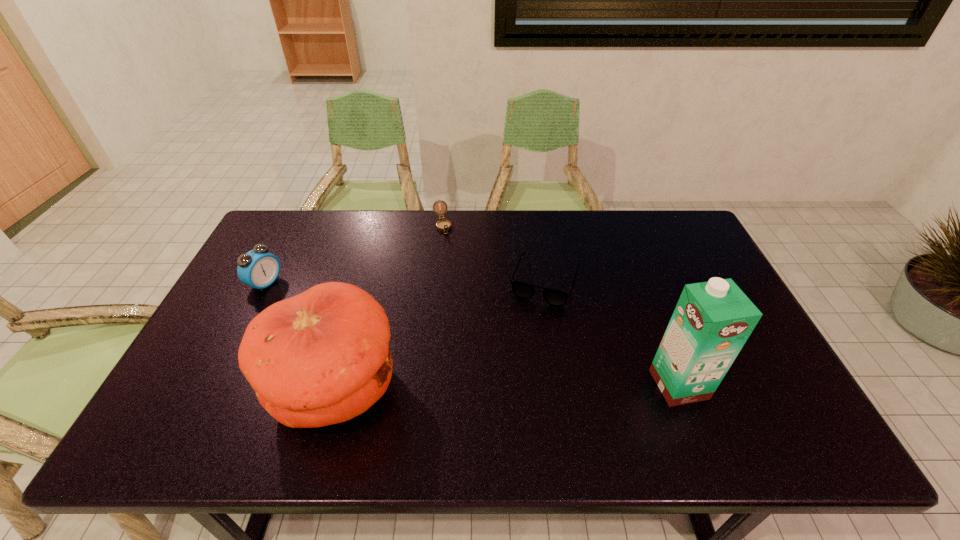
Identify the location of free space between the rightmost object and the spectacles. (612, 332).

Where is `vacant space in between the fourth object from right to left and the farthest object`? Image resolution: width=960 pixels, height=540 pixels. vacant space in between the fourth object from right to left and the farthest object is located at coordinates (389, 307).

I want to click on empty location between the fourth object from right to left and the carton, so pyautogui.click(x=507, y=387).

You are a GUI agent. You are given a task and a screenshot of the screen. Output one action in this format:
    pyautogui.click(x=<x>, y=<y>)
    Task: Click on the unoccupied position between the pumpkin and the third object from left to right
    
    Given the screenshot: What is the action you would take?
    coord(389,307)

Identify the location of free space between the second object from left to right and the rightmost object. (507, 387).

What are the coordinates of `vacant area that lies between the carton and the second object from left to right` in the screenshot? It's located at [507, 387].

Identify which object is the nearest to the third shortest object. Please provide its 2D coordinates. Your answer should be formatted as a tuple, i.e. [(x, y)], where the tuple contains the x and y coordinates of a point satisfying the conditions above.

[(322, 357)]

At what (x,y) coordinates should I click in order to perform the action: click on object that stands as the closest to the spectacles. Please return your answer as a coordinate pair (x, y). Image resolution: width=960 pixels, height=540 pixels. Looking at the image, I should click on (444, 225).

Identify the location of vacant point that satisfies the following two spatial constraints: 1. on the front side of the alarm clock; 2. on the right side of the pumpkin. The height and width of the screenshot is (540, 960). (211, 389).

The width and height of the screenshot is (960, 540). I want to click on vacant space that satisfies the following two spatial constraints: 1. on the front side of the alarm clock; 2. on the left side of the rightmost object, so click(213, 384).